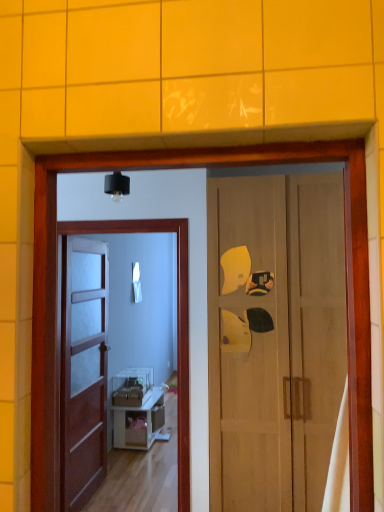
Question: Should I look upward or downward to see white glossy cabinet at center?

Choices:
 (A) down
 (B) up

Answer: (A)

Question: Considering the relative positions of wooden door at right, which ranks as the 1th door in right-to-left order, and white glossy cabinet at center in the image provided, is wooden door at right, which ranks as the 1th door in right-to-left order, to the right of white glossy cabinet at center from the viewer's perspective?

Choices:
 (A) yes
 (B) no

Answer: (A)

Question: Is wooden door at right, which ranks as the 1th door in right-to-left order, shorter than white glossy cabinet at center?

Choices:
 (A) yes
 (B) no

Answer: (B)

Question: Is wooden door at right, which ranks as the 1th door in right-to-left order, thinner than white glossy cabinet at center?

Choices:
 (A) no
 (B) yes

Answer: (A)

Question: From the image's perspective, is wooden door at right, the 2th door positioned from the left, beneath white glossy cabinet at center?

Choices:
 (A) yes
 (B) no

Answer: (B)

Question: Is wooden door at right, which ranks as the 1th door in right-to-left order, oriented towards white glossy cabinet at center?

Choices:
 (A) yes
 (B) no

Answer: (B)

Question: Could white glossy cabinet at center be considered to be inside wooden door at right, the 2th door positioned from the left?

Choices:
 (A) yes
 (B) no

Answer: (B)

Question: Is the depth of clear glass screen door at center greater than that of white glossy cabinet at center?

Choices:
 (A) no
 (B) yes

Answer: (A)

Question: Can we say clear glass screen door at center lies outside white glossy cabinet at center?

Choices:
 (A) yes
 (B) no

Answer: (A)

Question: Is clear glass screen door at center to the right of white glossy cabinet at center from the viewer's perspective?

Choices:
 (A) no
 (B) yes

Answer: (A)

Question: Is clear glass screen door at center placed right next to white glossy cabinet at center?

Choices:
 (A) yes
 (B) no

Answer: (B)

Question: Can you confirm if clear glass screen door at center is bigger than white glossy cabinet at center?

Choices:
 (A) yes
 (B) no

Answer: (A)

Question: From a real-world perspective, is clear glass screen door at center positioned over white glossy cabinet at center based on gravity?

Choices:
 (A) no
 (B) yes

Answer: (B)

Question: From a real-world perspective, is clear glass screen door at center located beneath wooden door at right, which ranks as the 1th door in right-to-left order?

Choices:
 (A) yes
 (B) no

Answer: (A)